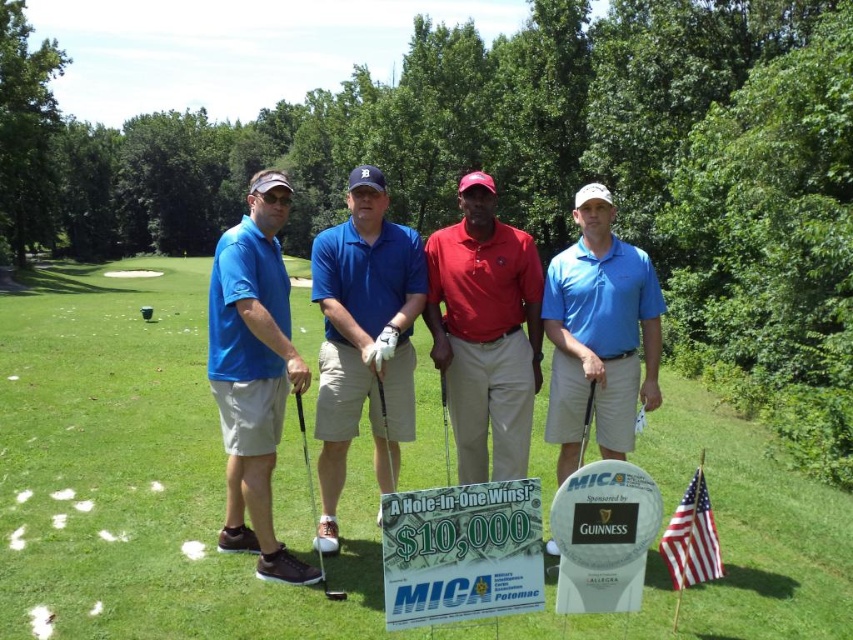
Question: Can you confirm if blue cotton polo shirt at center is thinner than matte blue shirt at left?

Choices:
 (A) yes
 (B) no

Answer: (A)

Question: Considering the relative positions of american flag at lower right and matte black golf club at center in the image provided, where is american flag at lower right located with respect to matte black golf club at center?

Choices:
 (A) above
 (B) below

Answer: (B)

Question: Estimate the real-world distances between objects in this image. Which object is closer to the glossy wood golf club at center?

Choices:
 (A) blue cotton polo shirt at center
 (B) matte black golf club at center

Answer: (A)

Question: Which of the following is the closest to the observer?

Choices:
 (A) shiny brown wood golf club at center
 (B) glossy wood golf club at center
 (C) matte blue polo shirt at center
 (D) green grass at center

Answer: (A)

Question: Can you confirm if matte red polo shirt at center is thinner than american flag at lower right?

Choices:
 (A) yes
 (B) no

Answer: (B)

Question: Which of the following is the closest to the observer?

Choices:
 (A) (444, 436)
 (B) (590, 419)
 (C) (355, 515)

Answer: (B)